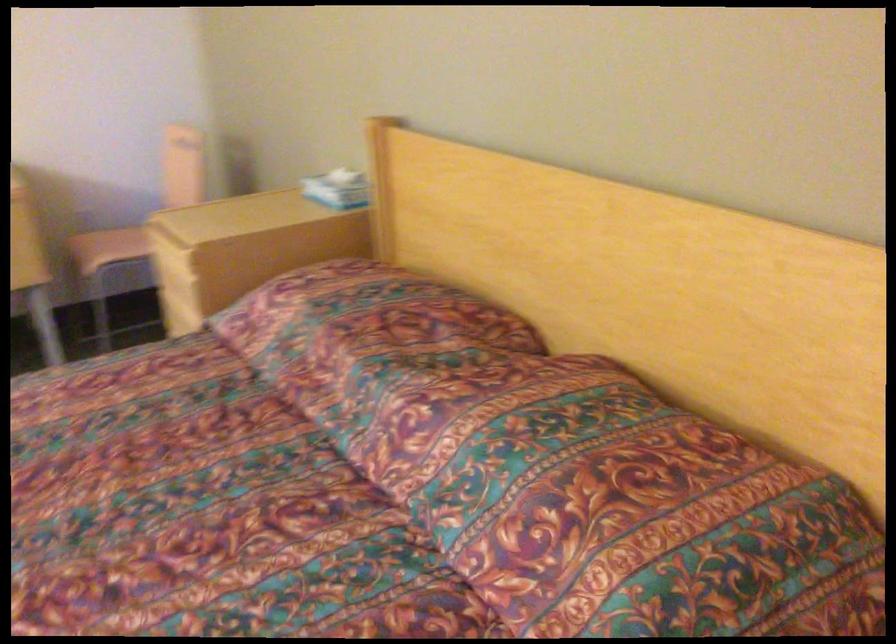
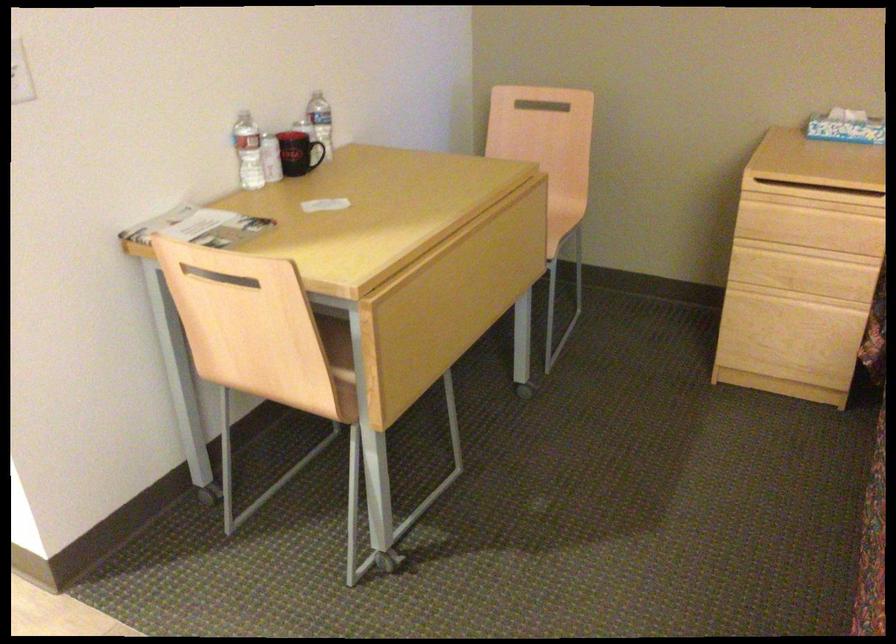
In the second image, find the point that corresponds to point (308, 187) in the first image.

(846, 127)